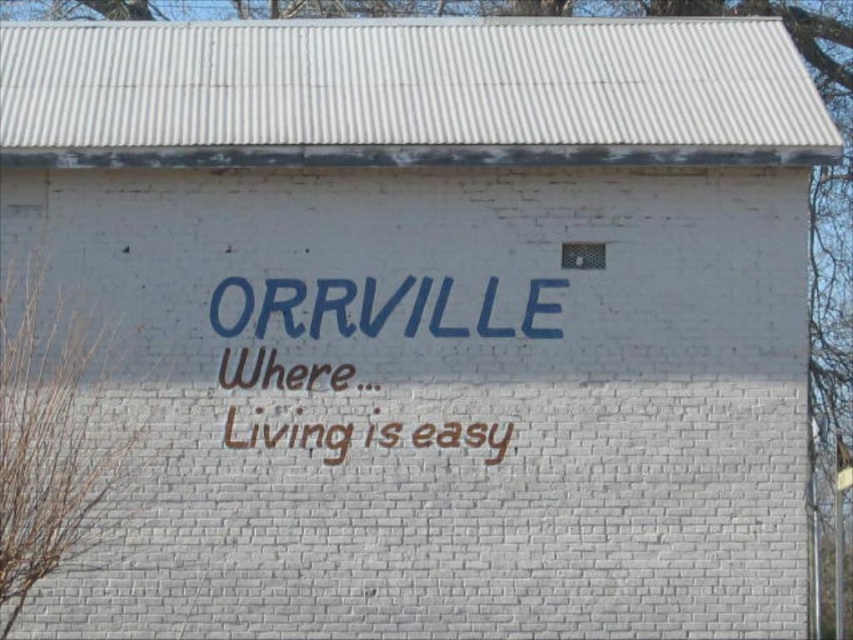
Question: Which point is farther from the camera taking this photo?

Choices:
 (A) (422, 435)
 (B) (250, 312)

Answer: (A)

Question: Which object appears closest to the camera in this image?

Choices:
 (A) blue painted text at center
 (B) brownmaterial/texturewriting at center

Answer: (B)

Question: Does blue painted text at center have a larger size compared to brownmaterial/texturewriting at center?

Choices:
 (A) yes
 (B) no

Answer: (B)

Question: In this image, where is blue painted text at center located relative to brownmaterial/texturewriting at center?

Choices:
 (A) above
 (B) below

Answer: (A)

Question: Can you confirm if blue painted text at center is thinner than brownmaterial/texturewriting at center?

Choices:
 (A) yes
 (B) no

Answer: (B)